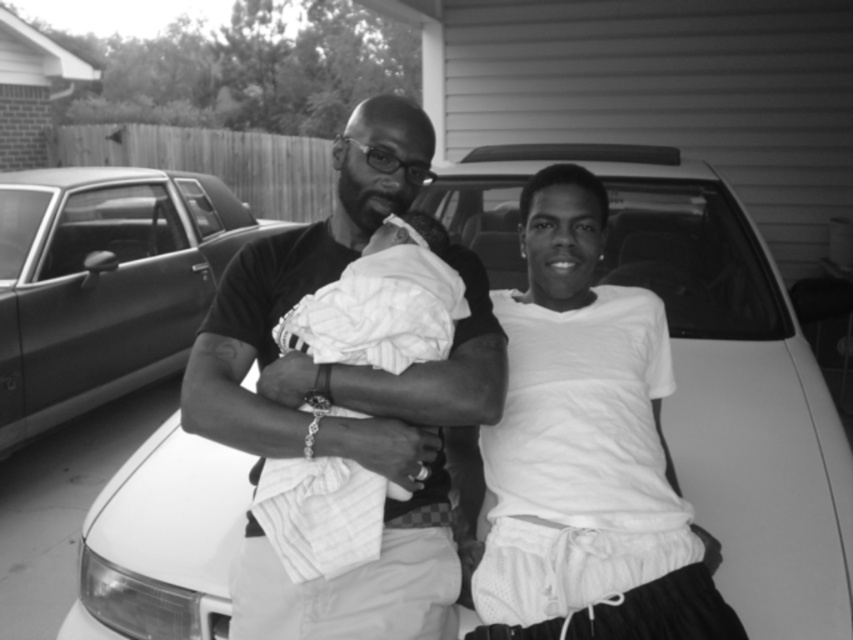
Who is taller, white matte car at center or metallic silver car at left?

metallic silver car at left

Can you confirm if white matte car at center is shorter than metallic silver car at left?

Correct, white matte car at center is not as tall as metallic silver car at left.

Locate an element on the screen. The width and height of the screenshot is (853, 640). white matte car at center is located at coordinates (708, 365).

In the scene shown: Who is positioned more to the right, white mesh shorts at center or metallic silver car at left?

Positioned to the right is white mesh shorts at center.

Does point (627, 500) come closer to viewer compared to point (177, 269)?

Yes, point (627, 500) is closer to viewer.

Image resolution: width=853 pixels, height=640 pixels. What do you see at coordinates (585, 448) in the screenshot? I see `white mesh shorts at center` at bounding box center [585, 448].

Find the location of `white mesh shorts at center`. white mesh shorts at center is located at coordinates (585, 448).

Image resolution: width=853 pixels, height=640 pixels. What do you see at coordinates (708, 365) in the screenshot?
I see `white matte car at center` at bounding box center [708, 365].

Between white matte car at center and matte black t-shirt at center, which one is positioned lower?

matte black t-shirt at center is below.

Which is in front, point (664, 182) or point (390, 179)?

Point (390, 179) is in front.

Identify the location of white matte car at center. (708, 365).